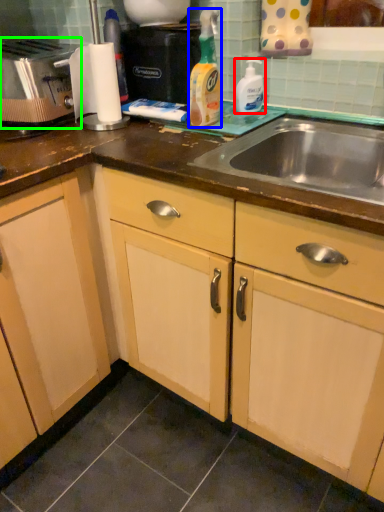
Question: Which object is the farthest from cleaning product (highlighted by a red box)? Choose among these: cleaning product (highlighted by a blue box) or toaster (highlighted by a green box).

Choices:
 (A) cleaning product
 (B) toaster

Answer: (B)